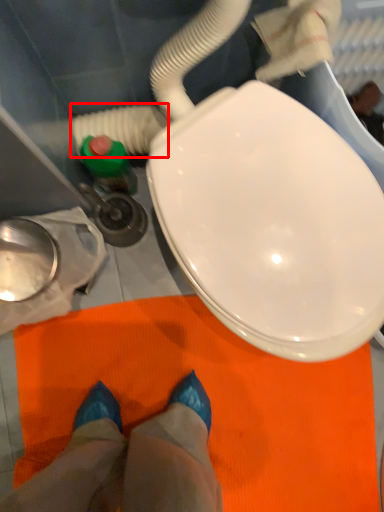
Question: From the image's perspective, where is water pipe (annotated by the red box) located relative to person?

Choices:
 (A) below
 (B) above

Answer: (B)